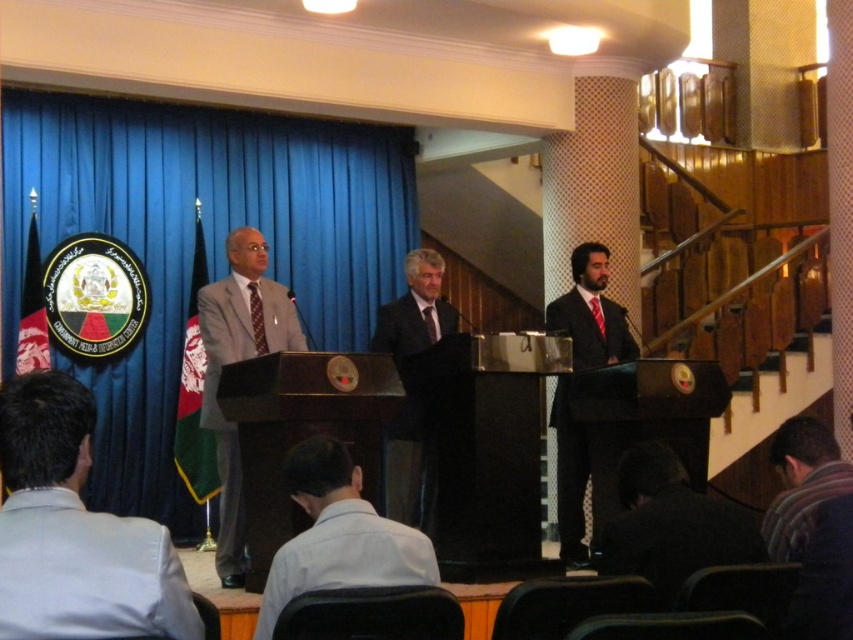
Question: Among these objects, which one is nearest to the camera?

Choices:
 (A) white fabric shirt at lower center
 (B) dark suit at center

Answer: (A)

Question: In this image, where is light gray suit at lower left located relative to matte gray suit at center?

Choices:
 (A) above
 (B) below

Answer: (A)

Question: Where is white fabric shirt at lower center located in relation to matte gray suit at center in the image?

Choices:
 (A) above
 (B) below

Answer: (B)

Question: Which is nearer to the light gray suit at lower left?

Choices:
 (A) white fabric shirt at lower center
 (B) dark gray suit at lower right
 (C) dark suit at center
 (D) striped sweater at lower right

Answer: (A)

Question: Is blue fabric curtain at left to the right of striped sweater at lower right from the viewer's perspective?

Choices:
 (A) yes
 (B) no

Answer: (B)

Question: Which point appears closest to the camera in this image?

Choices:
 (A) (418, 349)
 (B) (164, 468)
 (C) (799, 464)
 (D) (660, 566)

Answer: (D)